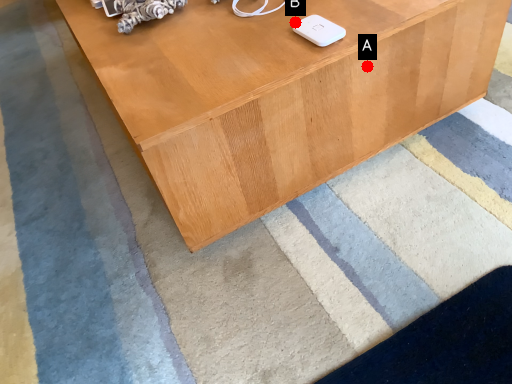
Question: Two points are circled on the image, labeled by A and B beside each circle. Which point is closer to the camera?

Choices:
 (A) A is closer
 (B) B is closer

Answer: (A)